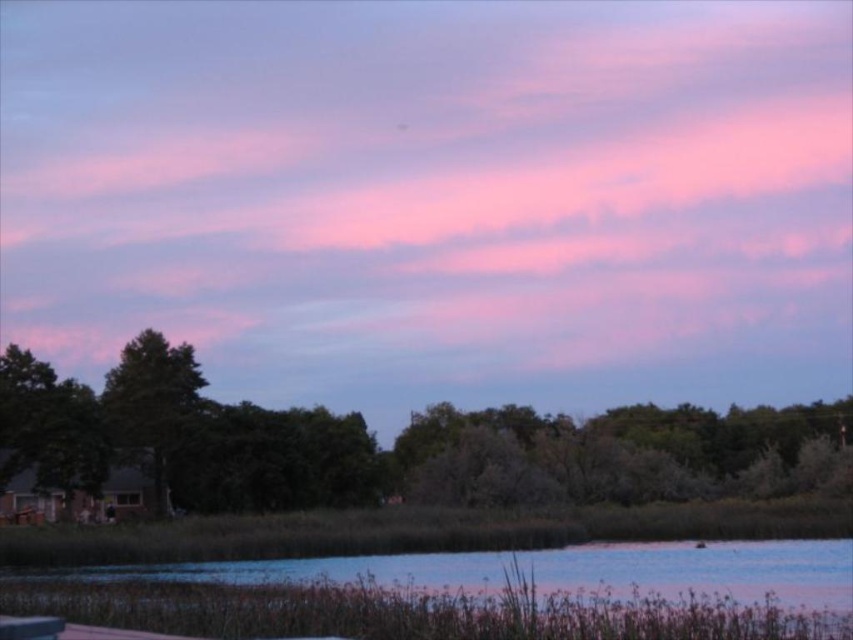
Question: Is pink fluffy cloud at upper center bigger than green leafy tree at lower left?

Choices:
 (A) yes
 (B) no

Answer: (A)

Question: Which point is farther to the camera?

Choices:
 (A) pink fluffy cloud at upper center
 (B) green leafy tree at lower left
 (C) green leafy tree at left
 (D) blue water at lower center

Answer: (A)

Question: From the image, what is the correct spatial relationship of pink fluffy cloud at upper center in relation to green leafy tree at left?

Choices:
 (A) left
 (B) right

Answer: (B)

Question: Which point appears closest to the camera in this image?

Choices:
 (A) (143, 564)
 (B) (370, 480)
 (C) (352, 40)

Answer: (A)

Question: Which point is closer to the camera?

Choices:
 (A) green leafy tree at lower left
 (B) pink fluffy cloud at upper center
 (C) green leafy tree at left

Answer: (A)

Question: Where is pink fluffy cloud at upper center located in relation to green leafy tree at lower left in the image?

Choices:
 (A) right
 (B) left

Answer: (B)